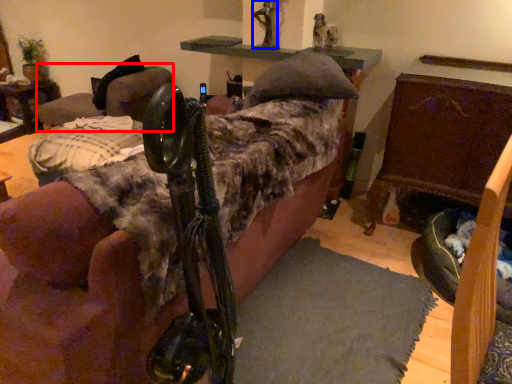
Question: Among these objects, which one is nearest to the camera, swivel chair (highlighted by a red box) or person (highlighted by a blue box)?

Choices:
 (A) swivel chair
 (B) person

Answer: (B)